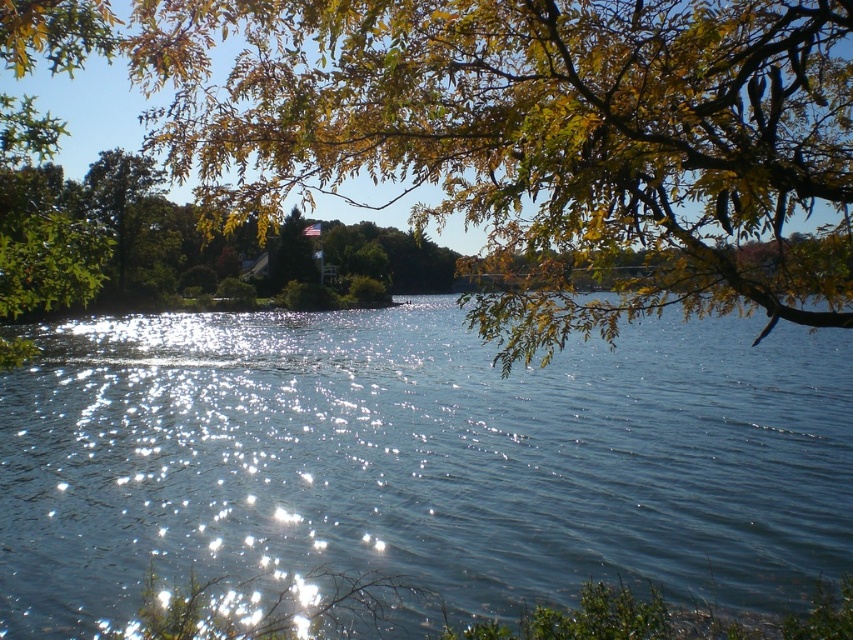
Can you confirm if blue water at center is wider than green leafy branches at upper center?

Indeed, blue water at center has a greater width compared to green leafy branches at upper center.

Can you confirm if blue water at center is positioned below green leafy branches at upper center?

Indeed, blue water at center is positioned under green leafy branches at upper center.

Is point (364, 563) positioned in front of point (432, 12)?

No, it is not.

This screenshot has width=853, height=640. What are the coordinates of `blue water at center` in the screenshot? It's located at (419, 460).